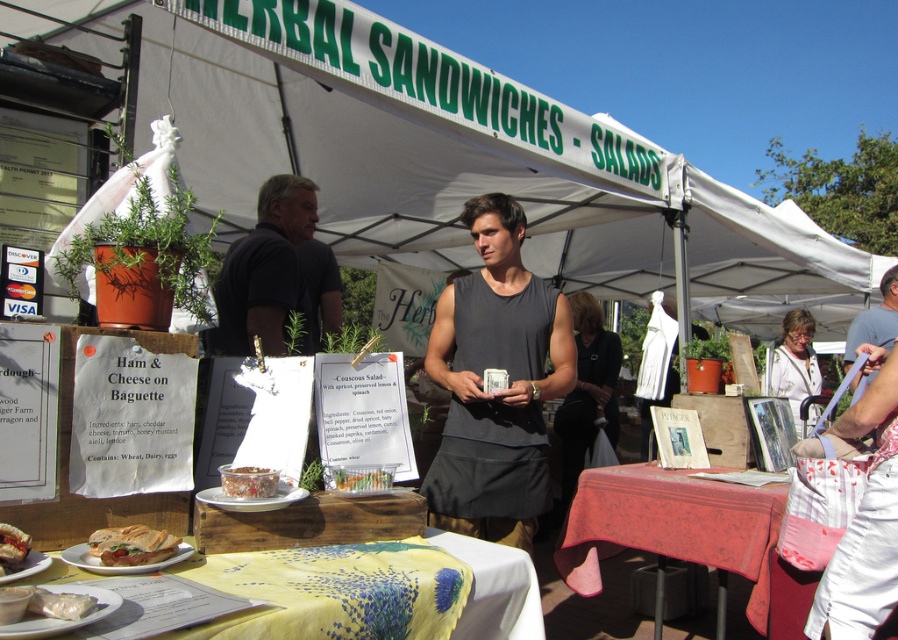
Question: Does black cotton shirt at center have a lesser width compared to white bread sandwich at lower left?

Choices:
 (A) yes
 (B) no

Answer: (B)

Question: Which object is closer to the camera taking this photo?

Choices:
 (A) green leafy salad at center
 (B) white bread sandwich at lower left
 (C) black fabric dress at center

Answer: (B)

Question: Estimate the real-world distances between objects in this image. Which object is closer to the black cotton shirt at center?

Choices:
 (A) white bread sandwich at lower left
 (B) shiny plastic container at center
 (C) black fabric dress at center

Answer: (B)

Question: Estimate the real-world distances between objects in this image. Which object is closer to the black cotton shirt at center?

Choices:
 (A) red fabric tablecloth at lower center
 (B) dark gray sleeveless tank top at center
 (C) gray sleeveless shirt at center

Answer: (B)

Question: Considering the relative positions of black fabric dress at center and gray sleeveless shirt at center in the image provided, where is black fabric dress at center located with respect to gray sleeveless shirt at center?

Choices:
 (A) right
 (B) left

Answer: (B)

Question: Can you confirm if red fabric tablecloth at lower center is positioned above black cotton shirt at center?

Choices:
 (A) no
 (B) yes

Answer: (A)